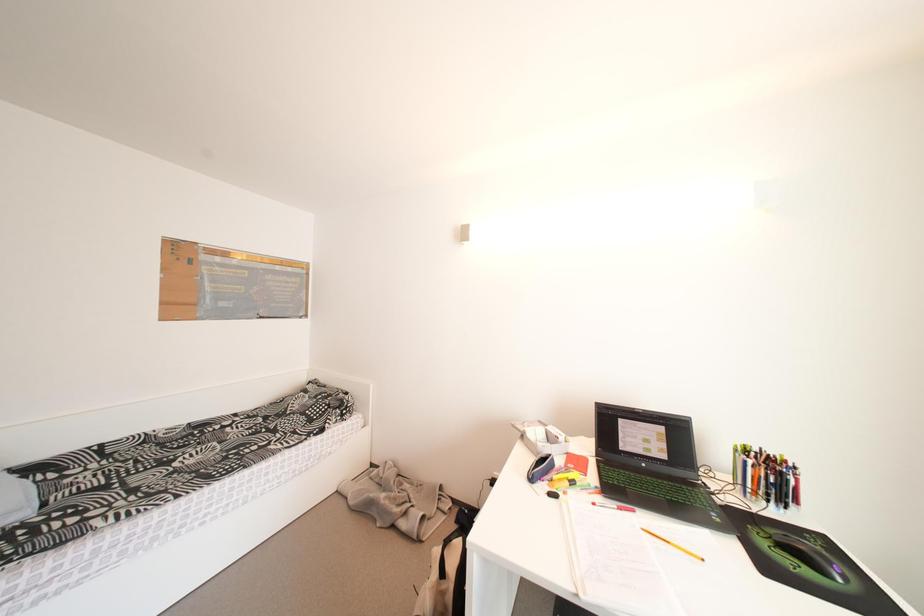
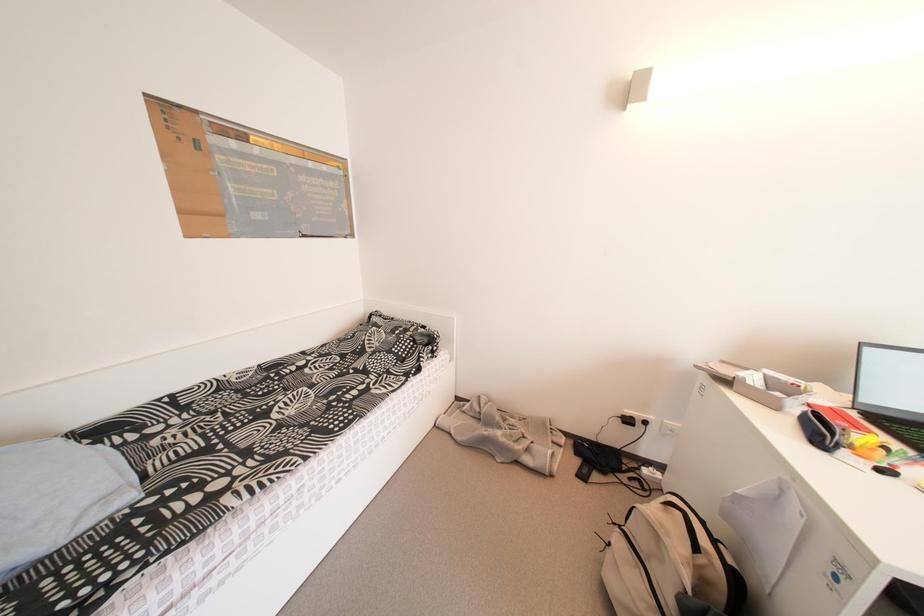
In a continuous first-person perspective shot, in which direction is the camera moving?

The cameraman moved toward left, forward.